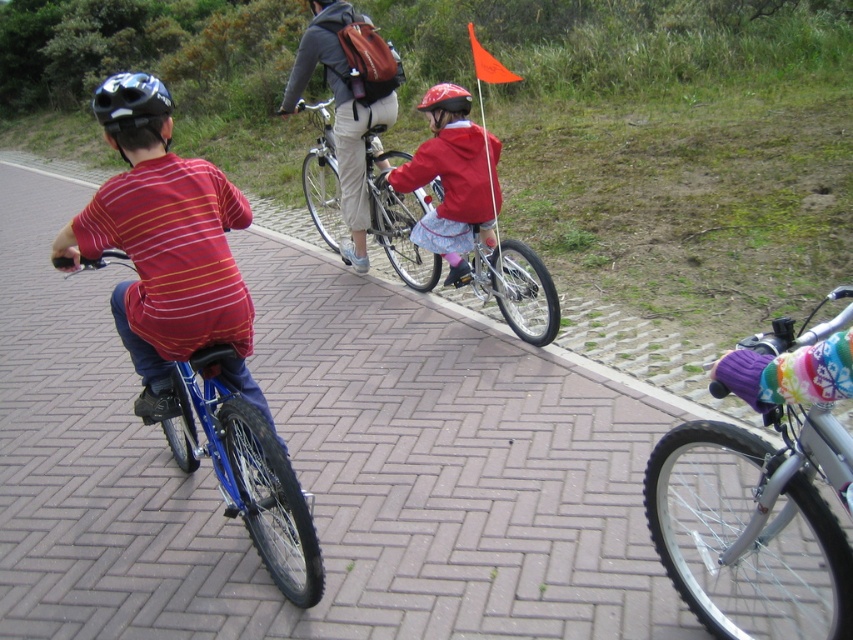
Question: From the image, what is the correct spatial relationship of blue metallic bicycle at left in relation to silver metallic bicycle at center?

Choices:
 (A) above
 (B) below

Answer: (B)

Question: Among these objects, which one is nearest to the camera?

Choices:
 (A) matte red jacket at center
 (B) matte black helmet at rear

Answer: (B)

Question: Which of these objects is positioned farthest from the blue metallic bicycle at left?

Choices:
 (A) orange fabric flag at upper center
 (B) silver metallic bicycle at lower right

Answer: (A)

Question: Which object is positioned closest to the matte red jacket at center?

Choices:
 (A) orange fabric flag at upper center
 (B) matte brown backpack at center

Answer: (B)

Question: Is silver metallic bicycle at lower right above blue metallic bicycle at left?

Choices:
 (A) no
 (B) yes

Answer: (A)

Question: Is matte red shirt at left positioned at the back of orange fabric flag at upper center?

Choices:
 (A) no
 (B) yes

Answer: (A)